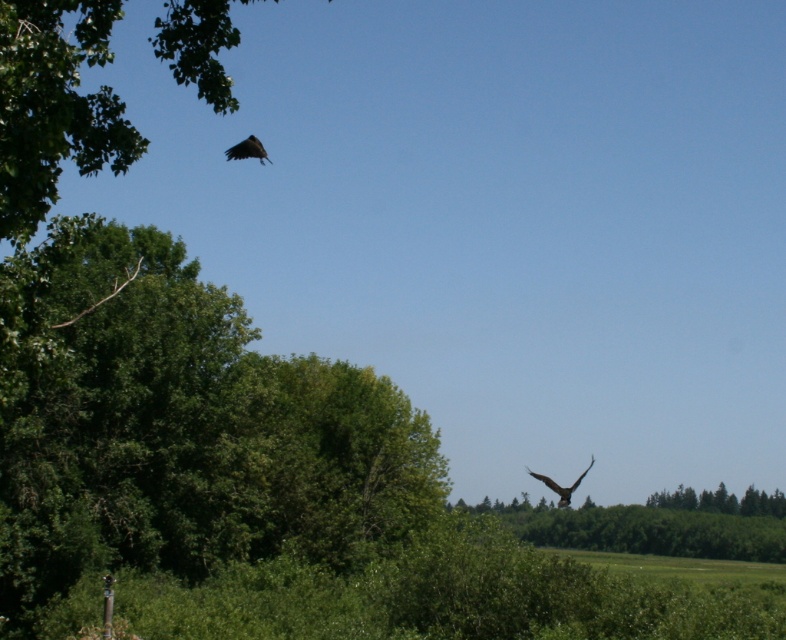
You are standing in the field looking towards the treeline. You see a green leafy tree at upper left and a green leafy tree at lower right. Which tree is positioned higher up in your field of view?

The green leafy tree at upper left is positioned higher up in your field of view compared to the green leafy tree at lower right.

You are a birdwatcher observing the scene. You notice the green leafy tree at upper left and the brown feathered eagle at lower right. Which object is taller in the image?

The green leafy tree at upper left is taller than the brown feathered eagle at lower right.

You are standing in the serene outdoor scene described. You want to locate the green leafy tree at upper left. Based on the coordinates provided, where should you look relative to the center of the image?

The green leafy tree at upper left is located at coordinates point (54,106), which is to the left and above the center of the image.